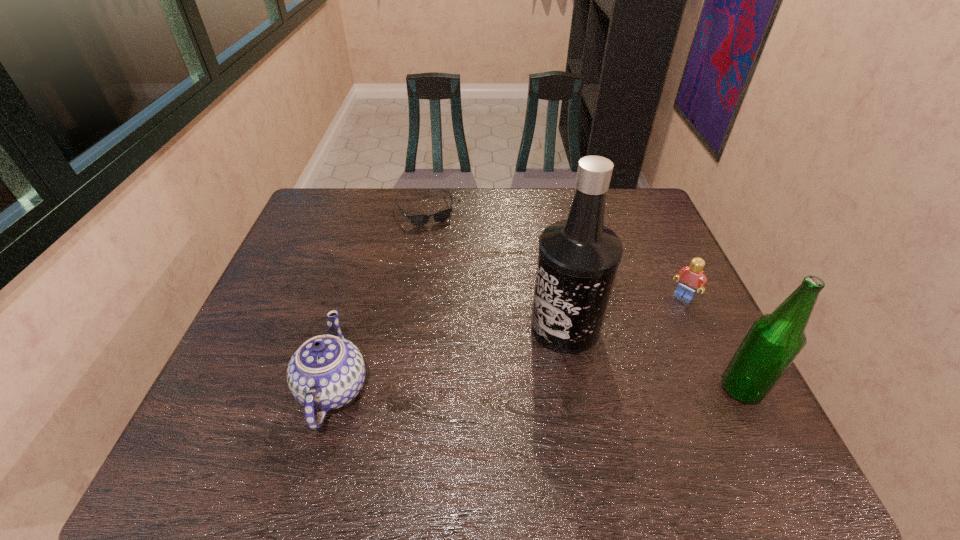
Locate an element on the screen. vacant space that satisfies the following two spatial constraints: 1. on the front side of the second tallest object; 2. on the label of the sunglasses is located at coordinates (396, 389).